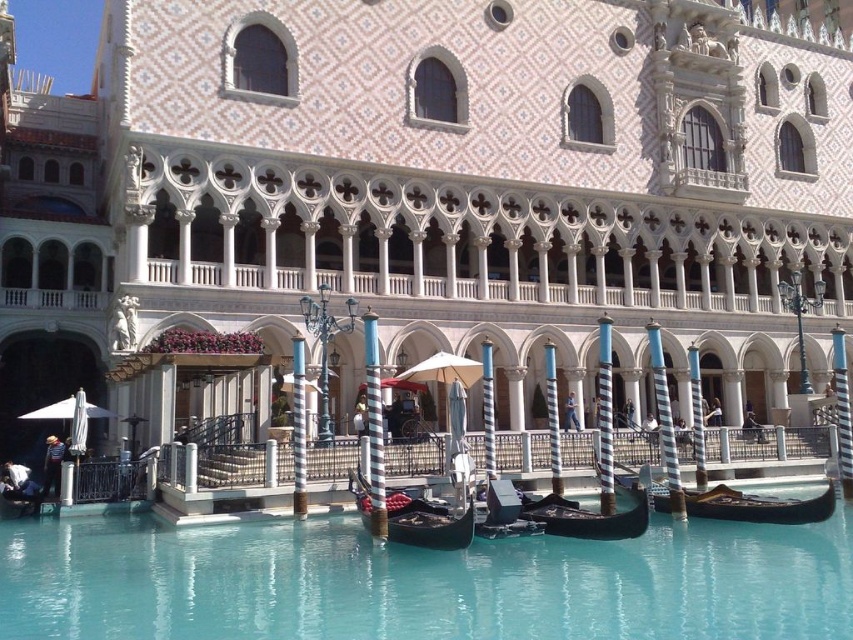
You are standing in front of the grand Venetian building and want to take a photo of the black polished wood gondola at center. The camera you are using has a maximum focus range of 40 meters. Will the camera be able to focus on the gondola?

The black polished wood gondola at center is 40.36 meters away from the camera. Since the camera can only focus up to 40 meters, it will not be able to focus on the gondola.

You are standing in front of the grand Venetian building and want to take a photo of both the point at coordinates (395, 534) and the point at coordinates (296, 472). Since you want both points to be in focus, which point should you focus on to ensure the other is also sharp?

You should focus on the point that is farther away, which is point (296, 472). By focusing on the farther point, the closer point (395, 534) will also be within the depth of field, ensuring both are in focus.

You are standing on the striped pole at the edge of the canal and want to board the black polished wood gondola at center. Which direction should you walk to reach the point marked at coordinates point (758,506)?

The point marked at coordinates point (758,506) is located on the black polished wood gondola at center, so you should walk towards the center of the canal to reach it.